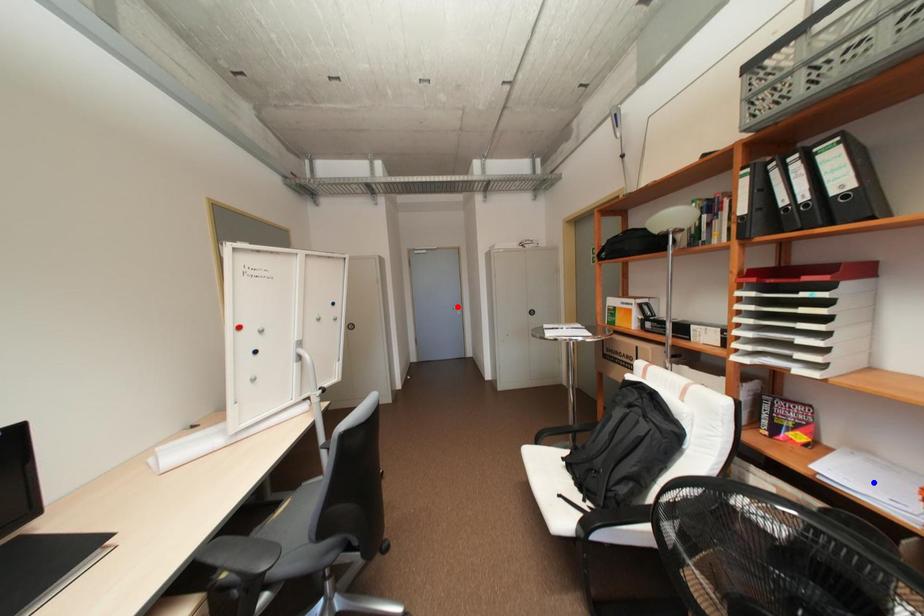
Question: Two points are marked on the image. Which point is closer to the camera?

Choices:
 (A) Blue point is closer.
 (B) Red point is closer.

Answer: (A)